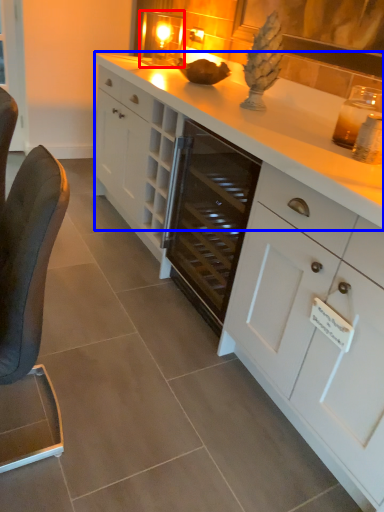
Question: Which object is further to the camera taking this photo, candle holder (highlighted by a red box) or countertop (highlighted by a blue box)?

Choices:
 (A) candle holder
 (B) countertop

Answer: (A)